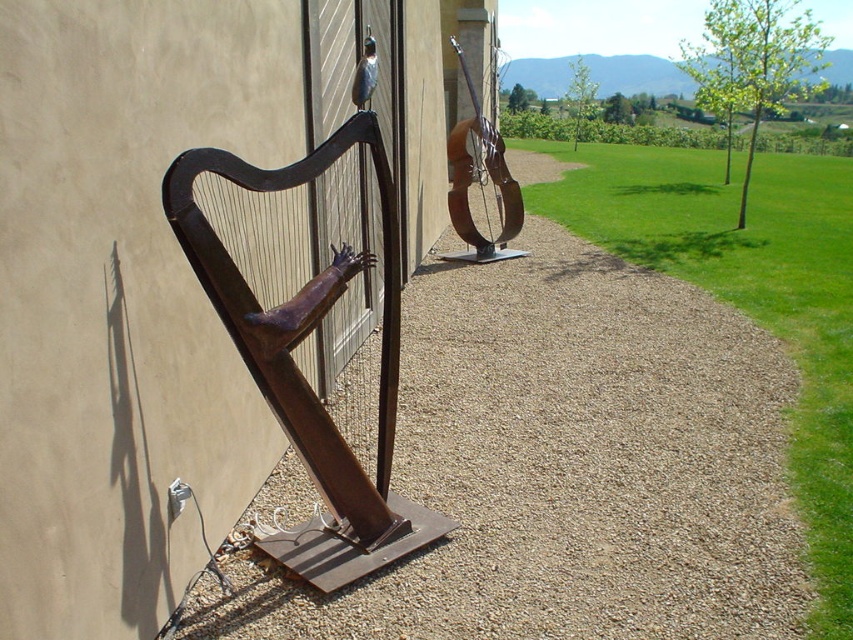
Between point (637, 435) and point (316, 468), which one is positioned in front?

Point (316, 468) is in front.

Does point (398, 577) come closer to viewer compared to point (352, 486)?

No.

Who is more forward, (457, 444) or (392, 252)?

Point (392, 252) is more forward.

Where is `brown gravel at center`? This screenshot has width=853, height=640. brown gravel at center is located at coordinates (567, 467).

Between brown gravel at center and rusty metal guitar at upper right, which one has less height?

brown gravel at center is shorter.

Which is below, brown gravel at center or rusty metal guitar at upper right?

brown gravel at center

At what (x,y) coordinates should I click in order to perform the action: click on brown gravel at center. Please return your answer as a coordinate pair (x, y). Looking at the image, I should click on (567, 467).

Is rusty metal harp at left further to camera compared to rusty metal guitar at upper right?

No, it is in front of rusty metal guitar at upper right.

Is point (352, 513) more distant than point (485, 253)?

No, it is not.

Locate an element on the screen. The width and height of the screenshot is (853, 640). rusty metal harp at left is located at coordinates (299, 344).